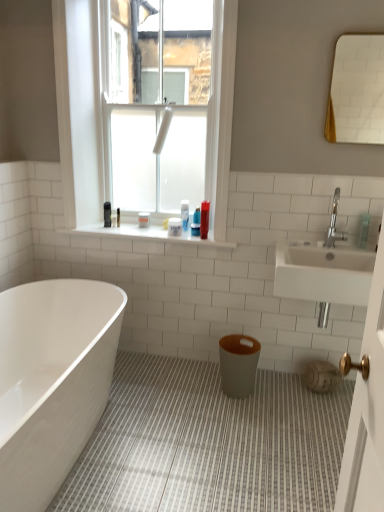
The height and width of the screenshot is (512, 384). Identify the location of vacant space underneath clear glass window at upper center (from a real-world perspective). pos(129,231).